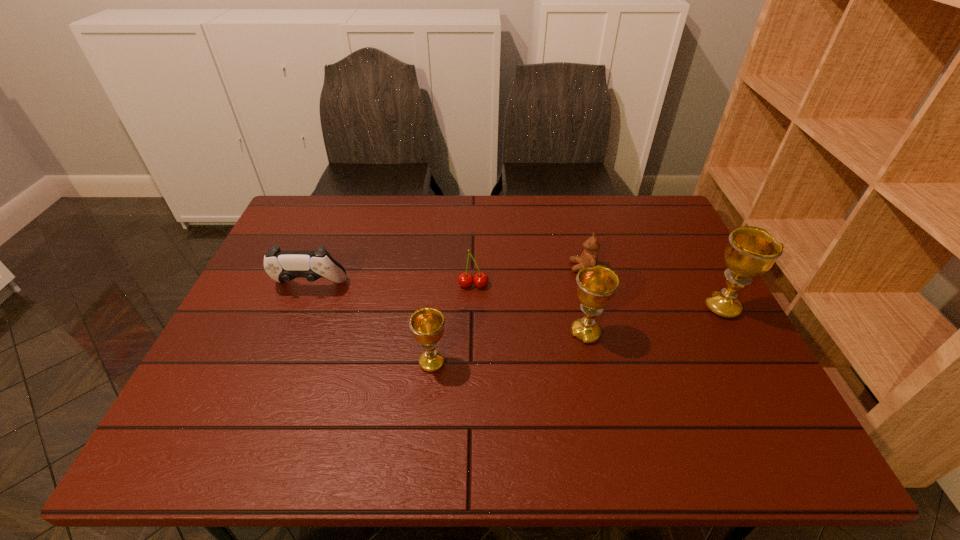
The width and height of the screenshot is (960, 540). What are the coordinates of `vacant point located 0.320m on the right of the fifth shortest object` in the screenshot? It's located at (732, 333).

This screenshot has height=540, width=960. What are the coordinates of `vacant space located on the left of the tallest object` in the screenshot? It's located at (602, 307).

Locate an element on the screen. vacant space located 0.220m with the stems of the cherry pointing upwards is located at coordinates (472, 356).

In order to click on free location located 0.340m on the front-facing side of the control in this screenshot , I will do `click(259, 410)`.

You are a GUI agent. You are given a task and a screenshot of the screen. Output one action in this format:
    pyautogui.click(x=<x>, y=<y>)
    Task: Click on the free location located on the face of the teddy bear
    Image resolution: width=960 pixels, height=540 pixels.
    Given the screenshot: What is the action you would take?
    pyautogui.click(x=498, y=267)

Image resolution: width=960 pixels, height=540 pixels. Find the location of `vacant space located on the face of the teddy bear`. vacant space located on the face of the teddy bear is located at coordinates (464, 267).

At what (x,y) coordinates should I click in order to perform the action: click on free space located 0.360m on the face of the teddy bear. Please return your answer as a coordinate pair (x, y). The height and width of the screenshot is (540, 960). Looking at the image, I should click on (446, 267).

I want to click on object that is at the left edge, so click(x=282, y=266).

The image size is (960, 540). I want to click on object situated at the right edge, so click(x=751, y=251).

Where is `vacant region at the far edge`? This screenshot has width=960, height=540. vacant region at the far edge is located at coordinates (445, 212).